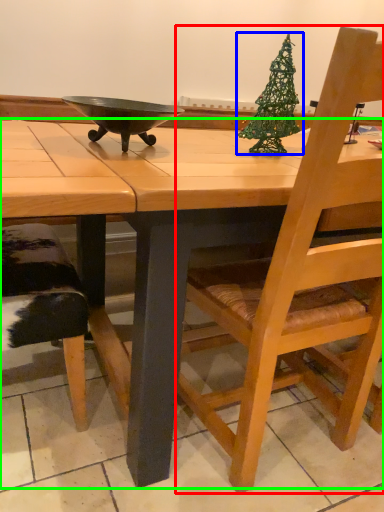
Question: Considering the real-world distances, which object is farthest from chair (highlighted by a red box)? christmas tree (highlighted by a blue box) or desk (highlighted by a green box)?

Choices:
 (A) christmas tree
 (B) desk

Answer: (A)